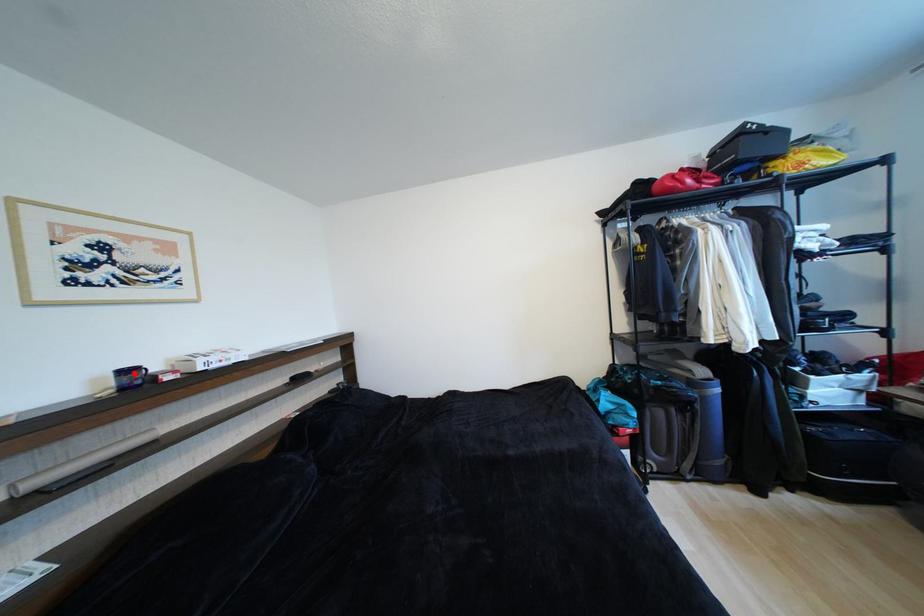
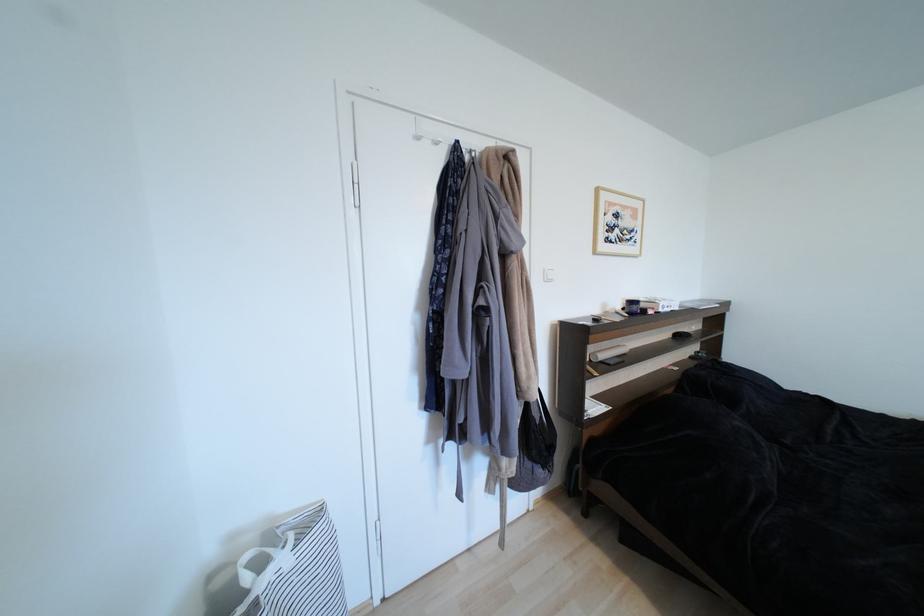
Locate, in the second image, the point that corresponds to the highlighted location in the first image.

(638, 304)